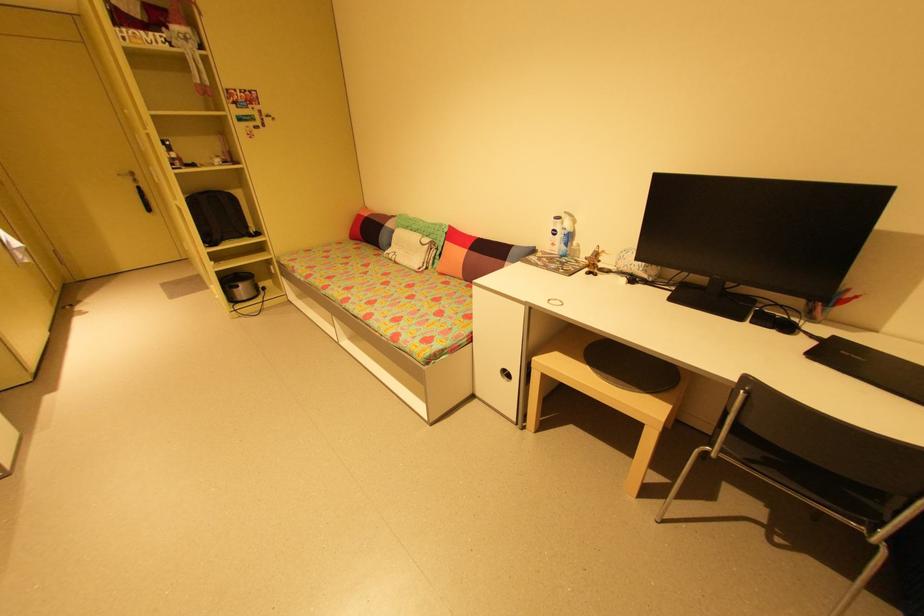
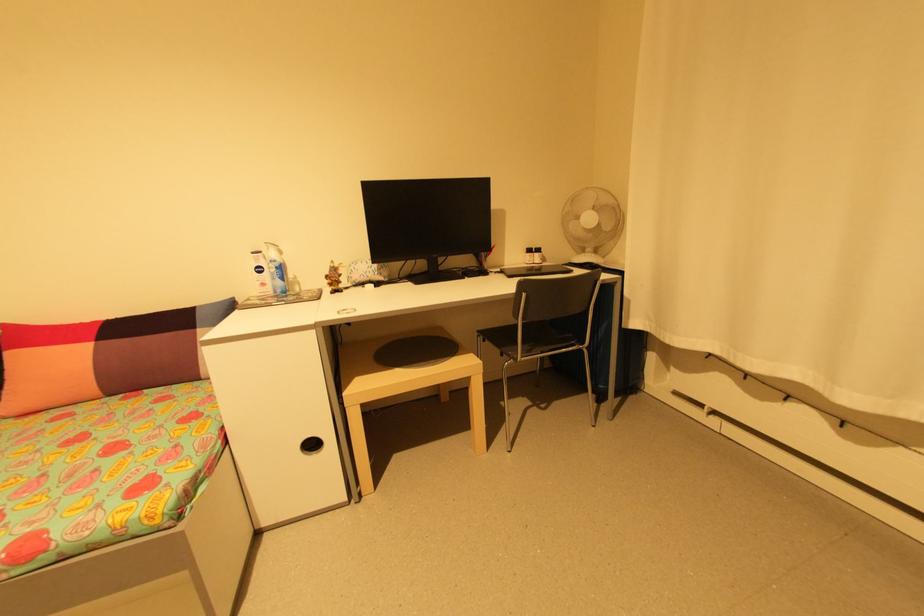
Find the pixel in the second image that matches [512,375] in the first image.

(317, 446)